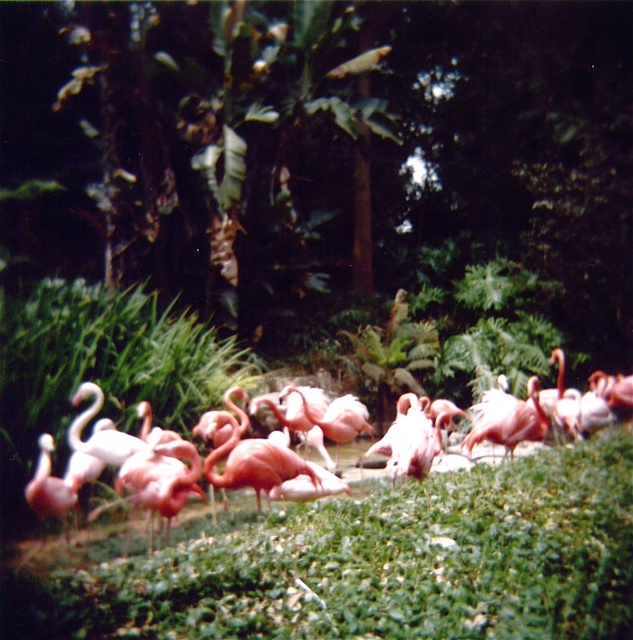
You are a photographer trying to capture the pink matte flamingo at lower left and the green leafy grass at center in the same frame. Based on their positions, which object should you focus on first to ensure both are in the frame?

The green leafy grass at center is positioned on the right side of the pink matte flamingo at lower left, so you should focus on the pink matte flamingo at lower left first to ensure both are in the frame.

You are a photographer trying to capture a clear shot of the pink matte flamingo at lower left. However, the green leafy grass at center is blocking your view. Can you determine if the grass is taller or shorter than the flamingo to decide whether you need to adjust your camera angle?

The green leafy grass at center is shorter than the pink matte flamingo at lower left, so you don not need to adjust your camera angle because the grass won not block the view.